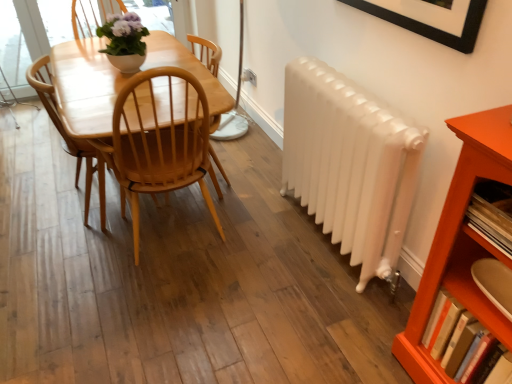
Find the location of `free space in front of light brown wood chair at center`. free space in front of light brown wood chair at center is located at coordinates (61, 253).